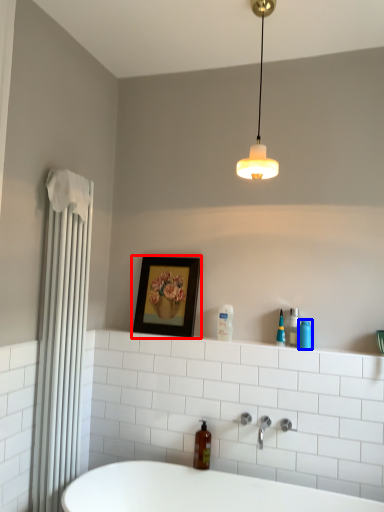
Question: Which of the following is the closest to the observer, picture frame (highlighted by a red box) or toiletry (highlighted by a blue box)?

Choices:
 (A) picture frame
 (B) toiletry

Answer: (B)